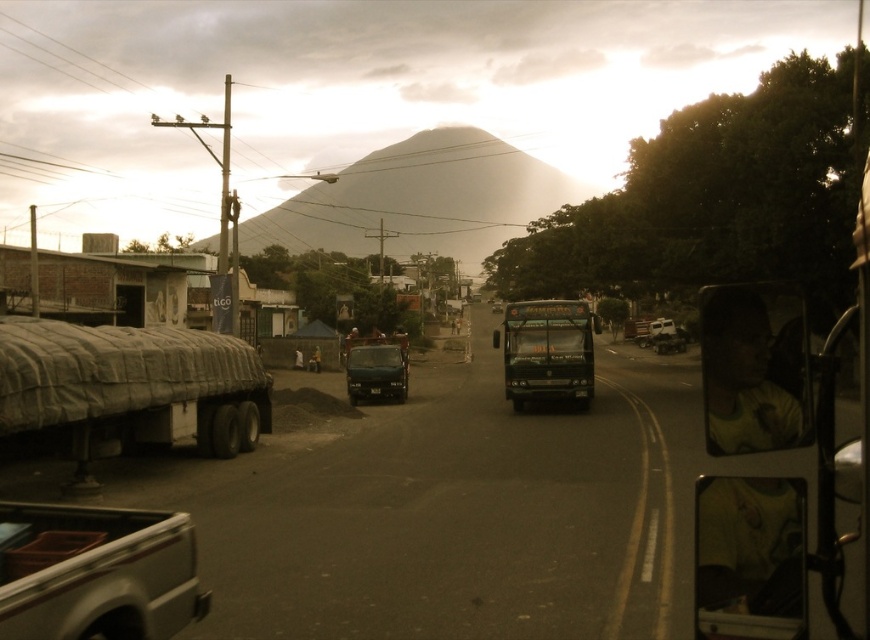
Question: Is smokey gray mountain at center bigger than white matte truck at lower left?

Choices:
 (A) no
 (B) yes

Answer: (B)

Question: Where is smokey gray mountain at center located in relation to metallic blue truck at center in the image?

Choices:
 (A) below
 (B) above

Answer: (B)

Question: Does textured gray tarpaulin at left appear on the right side of metallic blue truck at center?

Choices:
 (A) no
 (B) yes

Answer: (A)

Question: Which point is closer to the camera?

Choices:
 (A) 373,348
 (B) 507,316

Answer: (B)

Question: Which of the following is the farthest from the observer?

Choices:
 (A) (500, 307)
 (B) (405, 154)

Answer: (B)

Question: Which of the following is the closest to the observer?

Choices:
 (A) (72, 413)
 (B) (376, 360)
 (C) (440, 138)
 (D) (492, 305)

Answer: (A)